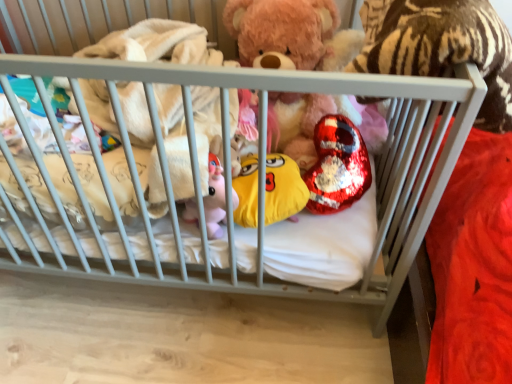
The height and width of the screenshot is (384, 512). What do you see at coordinates (337, 166) in the screenshot? I see `shiny sequined heart at center, which is the 1th toy in right-to-left order` at bounding box center [337, 166].

Locate an element on the screen. The height and width of the screenshot is (384, 512). fluffy pink teddy bear at center is located at coordinates (291, 34).

Are yellow plush toy at center, the first toy when ordered from left to right, and shiny sequined heart at center, which is the 1th toy in right-to-left order, far apart?

Actually, yellow plush toy at center, the first toy when ordered from left to right, and shiny sequined heart at center, which is the 1th toy in right-to-left order, are a little close together.

Is yellow plush toy at center, which is counted as the 2th toy, starting from the right, inside the boundaries of shiny sequined heart at center, which is the 1th toy in right-to-left order, or outside?

yellow plush toy at center, which is counted as the 2th toy, starting from the right, is not inside shiny sequined heart at center, which is the 1th toy in right-to-left order, it's outside.

Does yellow plush toy at center, the first toy when ordered from left to right, turn towards shiny sequined heart at center, arranged as the 2th toy when viewed from the left?

No, yellow plush toy at center, the first toy when ordered from left to right, is not facing towards shiny sequined heart at center, arranged as the 2th toy when viewed from the left.

In the scene shown: Can you tell me how much yellow plush toy at center, the first toy when ordered from left to right, and shiny sequined heart at center, arranged as the 2th toy when viewed from the left, differ in facing direction?

yellow plush toy at center, the first toy when ordered from left to right, and shiny sequined heart at center, arranged as the 2th toy when viewed from the left, are facing 0.000227 degrees away from each other.

Looking at this image, between fluffy pink teddy bear at center and shiny sequined heart at center, arranged as the 2th toy when viewed from the left, which one has less height?

shiny sequined heart at center, arranged as the 2th toy when viewed from the left, is shorter.

Is fluffy pink teddy bear at center facing away from shiny sequined heart at center, arranged as the 2th toy when viewed from the left?

That's not correct — fluffy pink teddy bear at center is not looking away from shiny sequined heart at center, arranged as the 2th toy when viewed from the left.

Relative to shiny sequined heart at center, arranged as the 2th toy when viewed from the left, is fluffy pink teddy bear at center in front or behind?

In the image, fluffy pink teddy bear at center appears in front of shiny sequined heart at center, arranged as the 2th toy when viewed from the left.

Does shiny sequined heart at center, which is the 1th toy in right-to-left order, have a smaller size compared to fluffy pink teddy bear at center?

Correct, shiny sequined heart at center, which is the 1th toy in right-to-left order, occupies less space than fluffy pink teddy bear at center.

From a real-world perspective, is shiny sequined heart at center, which is the 1th toy in right-to-left order, physically located above or below fluffy pink teddy bear at center?

In terms of real-world spatial position, shiny sequined heart at center, which is the 1th toy in right-to-left order, is below fluffy pink teddy bear at center.

Can you tell me how much fluffy pink teddy bear at center and yellow plush toy at center, which is counted as the 2th toy, starting from the right, differ in facing direction?

fluffy pink teddy bear at center and yellow plush toy at center, which is counted as the 2th toy, starting from the right, are facing 1.7 degrees away from each other.

Does point (303, 123) come behind point (237, 194)?

That is True.

From their relative heights in the image, would you say fluffy pink teddy bear at center is taller or shorter than yellow plush toy at center, which is counted as the 2th toy, starting from the right?

Clearly, fluffy pink teddy bear at center is taller compared to yellow plush toy at center, which is counted as the 2th toy, starting from the right.

Considering the relative sizes of fluffy pink teddy bear at center and yellow plush toy at center, the first toy when ordered from left to right, in the image provided, is fluffy pink teddy bear at center thinner than yellow plush toy at center, the first toy when ordered from left to right,?

No.

From a real-world perspective, which object stands above the other?

In real-world perspective, fluffy pink teddy bear at center is above.

Locate an element on the screen. The width and height of the screenshot is (512, 384). teddy bear lying on the right of yellow plush toy at center, the first toy when ordered from left to right is located at coordinates (291, 34).

Can you confirm if yellow plush toy at center, the first toy when ordered from left to right, is taller than fluffy pink teddy bear at center?

Result: No.

Which is more to the left, yellow plush toy at center, the first toy when ordered from left to right, or fluffy pink teddy bear at center?

yellow plush toy at center, the first toy when ordered from left to right.

Is shiny sequined heart at center, which is the 1th toy in right-to-left order, taller than yellow plush toy at center, the first toy when ordered from left to right?

Indeed, shiny sequined heart at center, which is the 1th toy in right-to-left order, has a greater height compared to yellow plush toy at center, the first toy when ordered from left to right.

Where is `toy above the yellow plush toy at center, the first toy when ordered from left to right (from the image's perspective)`? This screenshot has width=512, height=384. toy above the yellow plush toy at center, the first toy when ordered from left to right (from the image's perspective) is located at coordinates (337, 166).

Is shiny sequined heart at center, arranged as the 2th toy when viewed from the left, beside yellow plush toy at center, which is counted as the 2th toy, starting from the right?

No, shiny sequined heart at center, arranged as the 2th toy when viewed from the left, is not next to yellow plush toy at center, which is counted as the 2th toy, starting from the right.

You are a GUI agent. You are given a task and a screenshot of the screen. Output one action in this format:
    pyautogui.click(x=<x>, y=<y>)
    Task: Click on the toy in front of the shiny sequined heart at center, which is the 1th toy in right-to-left order
    The image size is (512, 384).
    Given the screenshot: What is the action you would take?
    pyautogui.click(x=283, y=188)

I want to click on the 1st toy below the fluffy pink teddy bear at center (from the image's perspective), so click(x=337, y=166).

Looking at the image, which one is located closer to shiny sequined heart at center, which is the 1th toy in right-to-left order, yellow plush toy at center, the first toy when ordered from left to right, or fluffy pink teddy bear at center?

Among the two, yellow plush toy at center, the first toy when ordered from left to right, is located nearer to shiny sequined heart at center, which is the 1th toy in right-to-left order.

Which object lies further to the anchor point fluffy pink teddy bear at center, shiny sequined heart at center, arranged as the 2th toy when viewed from the left, or yellow plush toy at center, which is counted as the 2th toy, starting from the right?

yellow plush toy at center, which is counted as the 2th toy, starting from the right, is further to fluffy pink teddy bear at center.

Estimate the real-world distances between objects in this image. Which object is further from yellow plush toy at center, which is counted as the 2th toy, starting from the right, fluffy pink teddy bear at center or shiny sequined heart at center, arranged as the 2th toy when viewed from the left?

Among the two, fluffy pink teddy bear at center is located further to yellow plush toy at center, which is counted as the 2th toy, starting from the right.

Considering their positions, is yellow plush toy at center, which is counted as the 2th toy, starting from the right, positioned further to fluffy pink teddy bear at center than shiny sequined heart at center, which is the 1th toy in right-to-left order?

yellow plush toy at center, which is counted as the 2th toy, starting from the right, is positioned further to the anchor fluffy pink teddy bear at center.

Based on their spatial positions, is shiny sequined heart at center, which is the 1th toy in right-to-left order, or fluffy pink teddy bear at center further from yellow plush toy at center, the first toy when ordered from left to right?

fluffy pink teddy bear at center.

From the image, which object appears to be nearer to shiny sequined heart at center, arranged as the 2th toy when viewed from the left, fluffy pink teddy bear at center or yellow plush toy at center, the first toy when ordered from left to right?

yellow plush toy at center, the first toy when ordered from left to right, is closer to shiny sequined heart at center, arranged as the 2th toy when viewed from the left.

I want to click on toy between fluffy pink teddy bear at center and yellow plush toy at center, which is counted as the 2th toy, starting from the right, in the up-down direction, so click(337, 166).